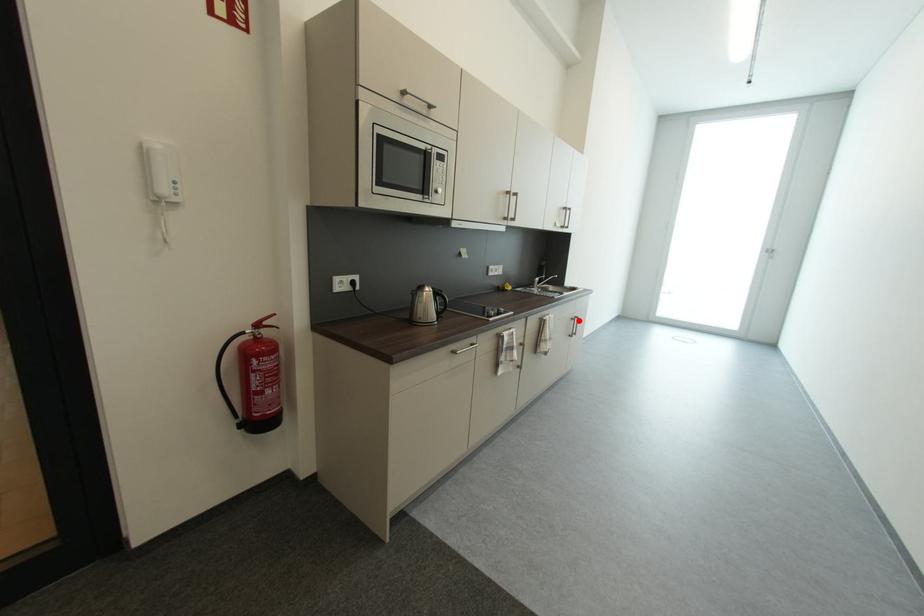
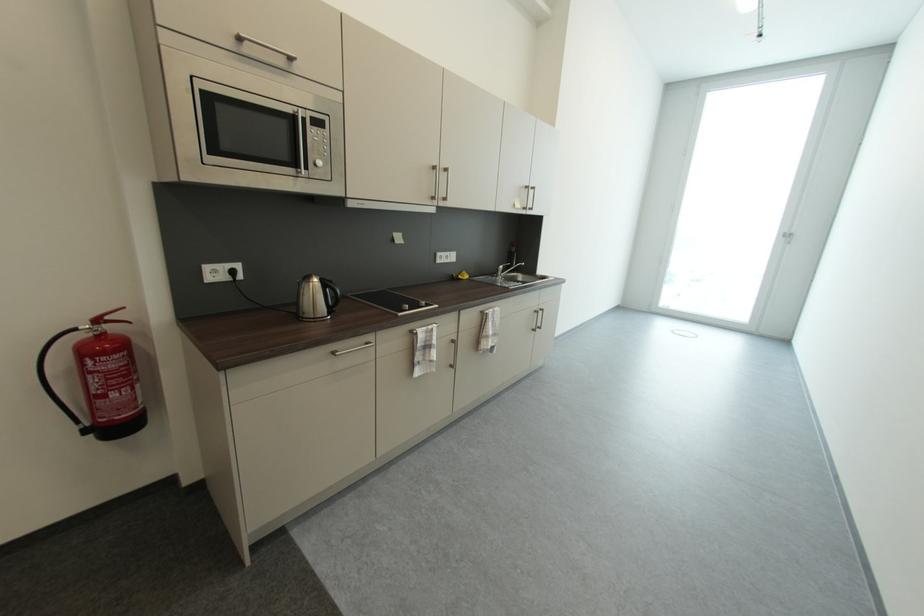
Question: I am providing you with two images of the same scene from different viewpoints. Given a red point in image1, look at the same physical point in image2. Is it:

Choices:
 (A) Closer to the viewpoint
 (B) Farther from the viewpoint

Answer: (A)